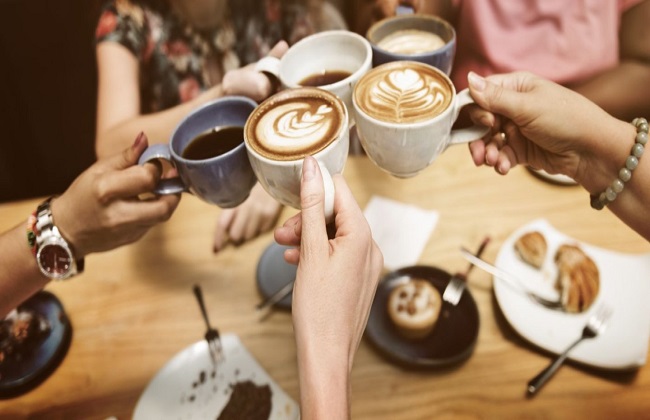
Locate an element on the screen. plate is located at coordinates (44, 313), (283, 273), (169, 393), (447, 347), (546, 323).